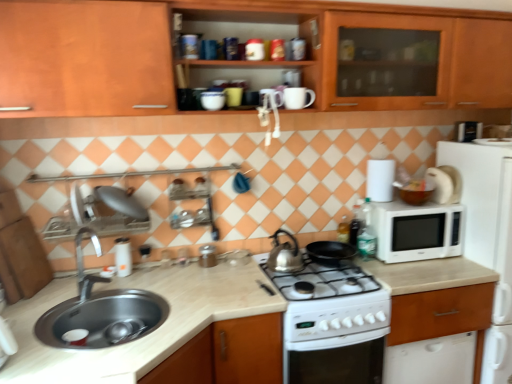
I want to click on vacant area to the right of matte wood cabinet at left, which ranks as the 2th cabinetry in bottom-to-top order, so click(68, 285).